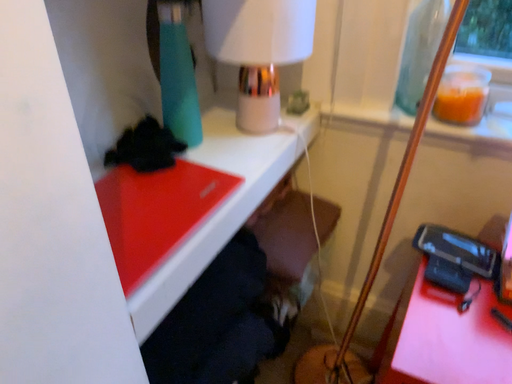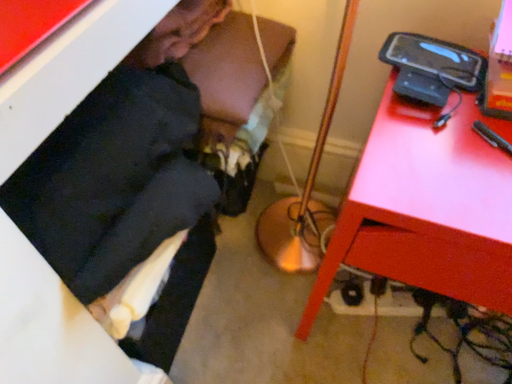
Question: How did the camera likely rotate when shooting the video?

Choices:
 (A) rotated upward
 (B) rotated downward

Answer: (B)